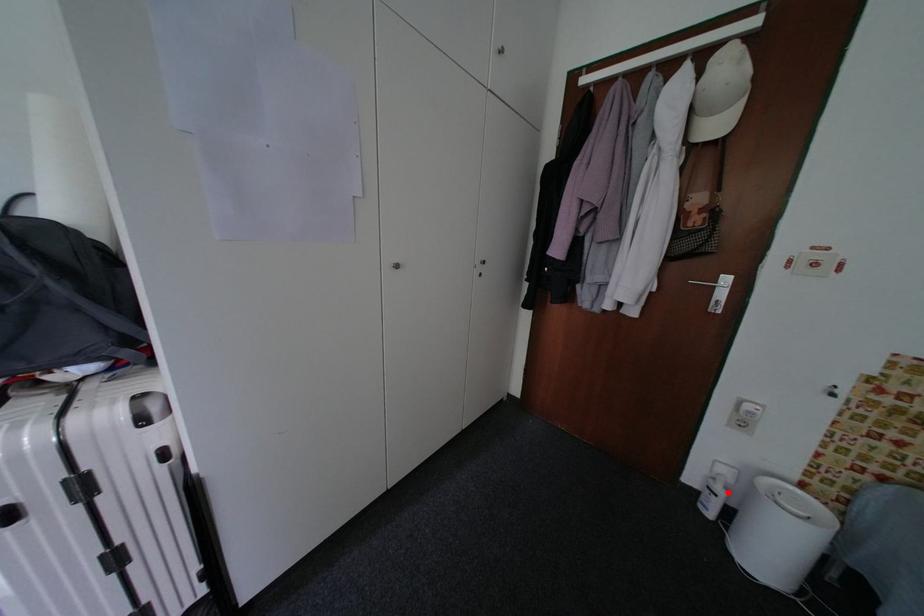
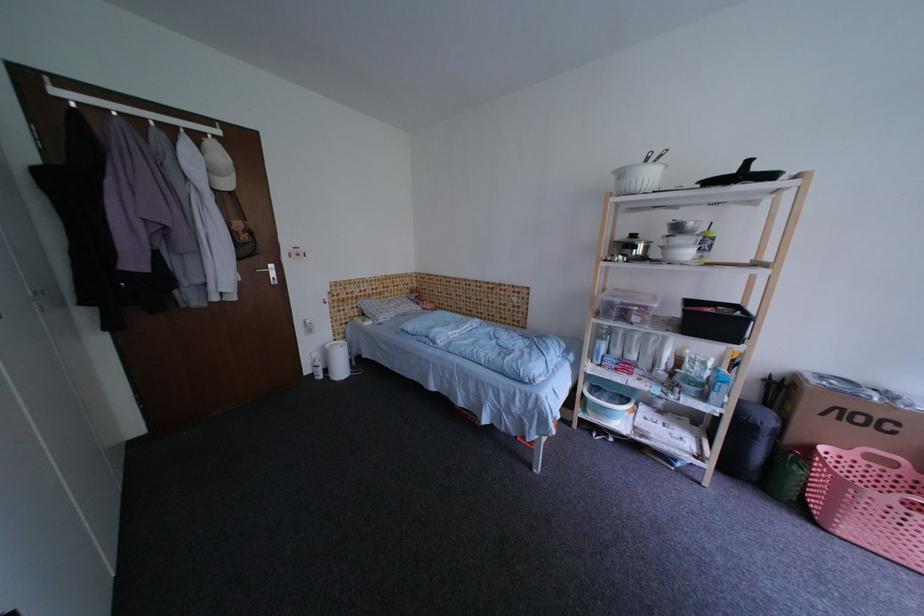
The point at the highlighted location is marked in the first image. Where is the corresponding point in the second image?

(326, 366)